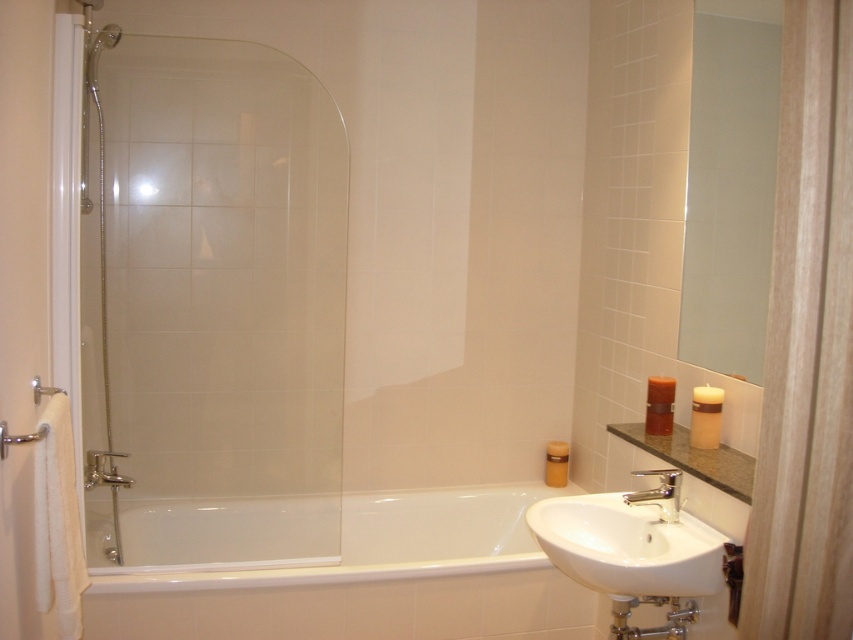
Who is shorter, clear glass shower door at left or white glossy bathtub at center?

With less height is white glossy bathtub at center.

Who is taller, clear glass shower door at left or white glossy bathtub at center?

Standing taller between the two is clear glass shower door at left.

Where is `clear glass shower door at left`? clear glass shower door at left is located at coordinates (213, 305).

Between point (709, 556) and point (633, 472), which one is positioned in front?

Point (709, 556) is in front.

Is white ceramic sink at lower right positioned in front of silver metallic faucet at lower center?

Yes, it is.

This screenshot has width=853, height=640. In order to click on white ceramic sink at lower right in this screenshot , I will do `click(631, 541)`.

Is wooden screen door at right closer to camera compared to silver metallic faucet at lower center?

Yes, wooden screen door at right is in front of silver metallic faucet at lower center.

Which is in front, point (807, 547) or point (675, 518)?

Point (807, 547)

Which is in front, point (848, 624) or point (637, 474)?

Point (848, 624)

In order to click on wooden screen door at right in this screenshot , I will do `click(807, 346)`.